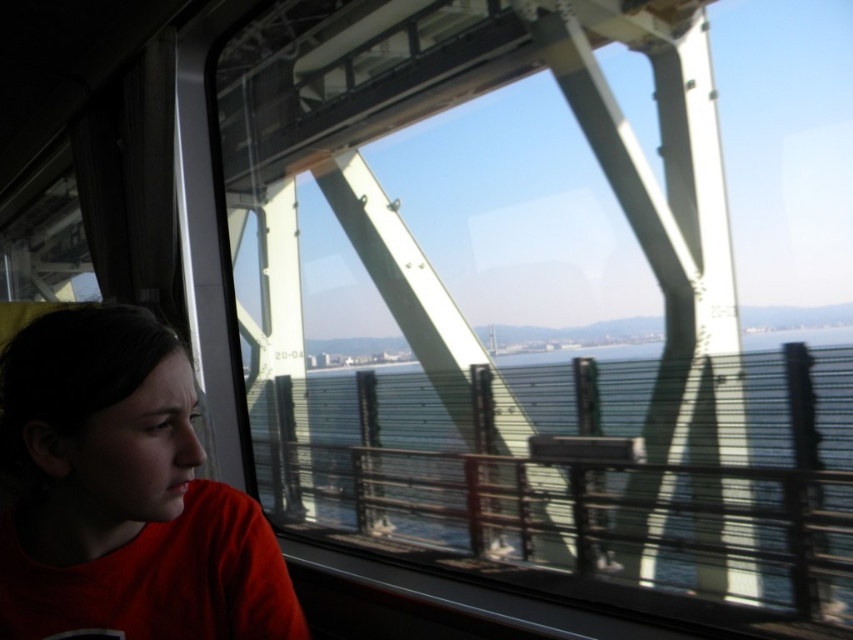
Can you confirm if clear glass water at center is positioned to the right of matte red shirt at left?

Indeed, clear glass water at center is positioned on the right side of matte red shirt at left.

Identify the location of clear glass water at center. (589, 468).

Between point (344, 509) and point (119, 426), which one is positioned in front?

Point (119, 426) is more forward.

You are a GUI agent. You are given a task and a screenshot of the screen. Output one action in this format:
    pyautogui.click(x=<x>, y=<y>)
    Task: Click on the clear glass water at center
    This screenshot has width=853, height=640.
    Given the screenshot: What is the action you would take?
    pyautogui.click(x=589, y=468)